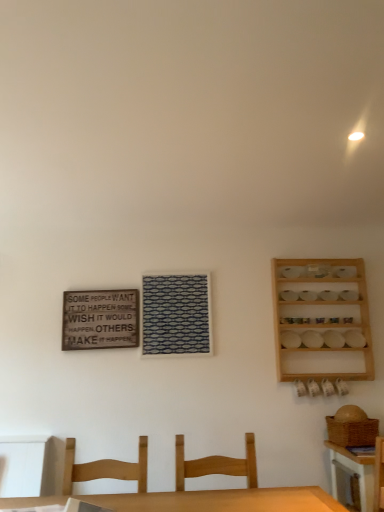
Question: Is wooden table at lower right positioned before wooden spice rack at right?

Choices:
 (A) yes
 (B) no

Answer: (A)

Question: Is wooden table at lower right placed right next to wooden spice rack at right?

Choices:
 (A) no
 (B) yes

Answer: (A)

Question: From the image's perspective, does wooden table at lower right appear higher than wooden spice rack at right?

Choices:
 (A) yes
 (B) no

Answer: (B)

Question: Would you say wooden table at lower right contains wooden spice rack at right?

Choices:
 (A) yes
 (B) no

Answer: (B)

Question: Does wooden table at lower right have a smaller size compared to wooden spice rack at right?

Choices:
 (A) no
 (B) yes

Answer: (A)

Question: Is wooden table at lower right facing away from wooden spice rack at right?

Choices:
 (A) yes
 (B) no

Answer: (B)

Question: Considering the relative sizes of wooden table at lower right and wooden signboard at upper left in the image provided, is wooden table at lower right thinner than wooden signboard at upper left?

Choices:
 (A) yes
 (B) no

Answer: (B)

Question: Is wooden table at lower right turned away from wooden signboard at upper left?

Choices:
 (A) no
 (B) yes

Answer: (A)

Question: Can you confirm if wooden table at lower right is taller than wooden signboard at upper left?

Choices:
 (A) no
 (B) yes

Answer: (B)

Question: Considering the relative positions of wooden table at lower right and wooden signboard at upper left in the image provided, is wooden table at lower right to the left of wooden signboard at upper left from the viewer's perspective?

Choices:
 (A) yes
 (B) no

Answer: (B)

Question: Does wooden table at lower right touch wooden signboard at upper left?

Choices:
 (A) yes
 (B) no

Answer: (B)

Question: From the image's perspective, is wooden table at lower right on top of wooden signboard at upper left?

Choices:
 (A) no
 (B) yes

Answer: (A)

Question: Is wooden spice rack at right far away from light brown wood chair at lower center, placed as the second chair when sorted from right to left?

Choices:
 (A) no
 (B) yes

Answer: (B)